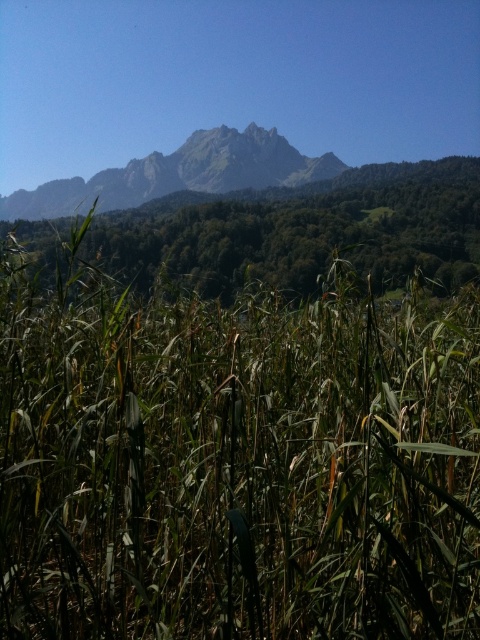
Consider the image. Does green grassy field at center come in front of rugged granite mountain range at upper center?

Yes, green grassy field at center is in front of rugged granite mountain range at upper center.

Does green grassy field at center appear on the right side of rugged granite mountain range at upper center?

Yes, green grassy field at center is to the right of rugged granite mountain range at upper center.

Does point (210, 310) lie behind point (128, 177)?

No, it is not.

The image size is (480, 640). I want to click on green grassy field at center, so click(235, 461).

Between green grassy field at center and green grass at center, which one appears on the left side from the viewer's perspective?

green grass at center

Is the position of green grassy field at center more distant than that of green grass at center?

No, it is in front of green grass at center.

Is point (43, 454) closer to camera compared to point (429, 198)?

Yes, point (43, 454) is in front of point (429, 198).

Where is `green grassy field at center`? Image resolution: width=480 pixels, height=640 pixels. green grassy field at center is located at coordinates (235, 461).

Is green grass at center positioned behind rugged granite mountain range at upper center?

No, it is in front of rugged granite mountain range at upper center.

Does point (402, 248) come closer to viewer compared to point (228, 170)?

Yes, it is in front of point (228, 170).

Does point (371, 244) come behind point (12, 205)?

No, it is in front of (12, 205).

Where is `green grass at center`? This screenshot has height=640, width=480. green grass at center is located at coordinates (302, 230).